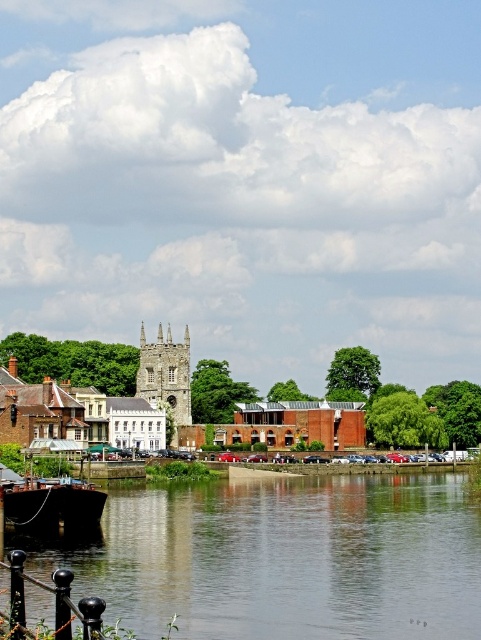
Question: Does brown brick building at center appear over dark brown wooden boat at lower left?

Choices:
 (A) yes
 (B) no

Answer: (A)

Question: Does dark brown wooden boat at lower left appear over stone tower at center?

Choices:
 (A) yes
 (B) no

Answer: (B)

Question: Which of these objects is positioned farthest from the brown brick building at center?

Choices:
 (A) stone tower at center
 (B) dark brown wooden boat at lower left
 (C) smooth concrete river at lower center

Answer: (B)

Question: Which of these objects is positioned farthest from the smooth concrete river at lower center?

Choices:
 (A) dark brown wooden boat at lower left
 (B) stone tower at center
 (C) brown brick building at center

Answer: (C)

Question: Which of the following is the closest to the observer?

Choices:
 (A) dark brown wooden boat at lower left
 (B) smooth concrete river at lower center

Answer: (B)

Question: Is brown brick building at center in front of dark brown wooden boat at lower left?

Choices:
 (A) no
 (B) yes

Answer: (A)